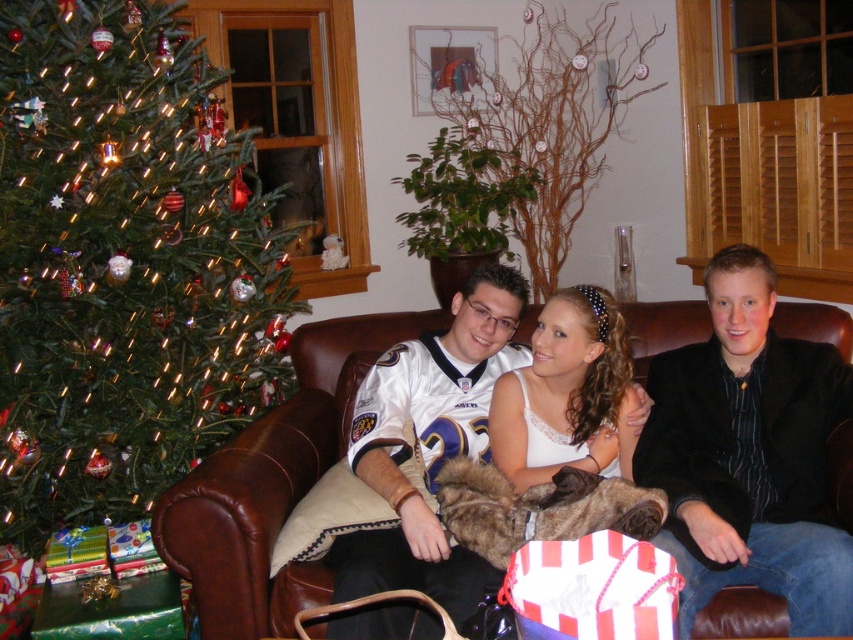
Question: Which of the following is the farthest from the observer?

Choices:
 (A) brown leather couch at center
 (B) white lace dress at center

Answer: (B)

Question: Which point appears farthest from the camera in this image?

Choices:
 (A) (734, 595)
 (B) (172, 163)
 (C) (393, 419)

Answer: (B)

Question: Where is green matte christmas tree at left located in relation to white lace dress at center in the image?

Choices:
 (A) left
 (B) right

Answer: (A)

Question: Which of the following is the farthest from the observer?

Choices:
 (A) (380, 627)
 (B) (285, 492)
 (C) (502, 378)
 (D) (715, 285)

Answer: (C)

Question: In this image, where is green matte christmas tree at left located relative to white jersey at center?

Choices:
 (A) below
 (B) above

Answer: (B)

Question: Can you confirm if brown leather couch at center is smaller than white lace dress at center?

Choices:
 (A) yes
 (B) no

Answer: (B)